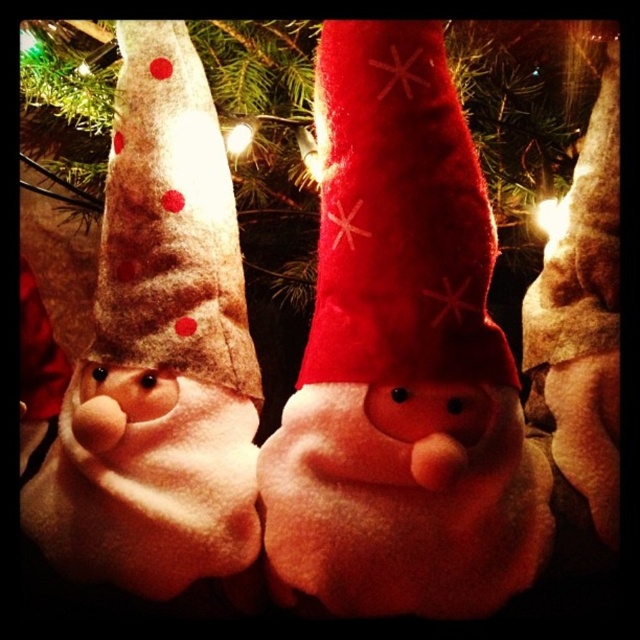
Between beige felt gnome at left and red felt santa hat at center, which one is positioned higher?

red felt santa hat at center is higher up.

Can you confirm if beige felt gnome at left is shorter than red felt santa hat at center?

In fact, beige felt gnome at left may be taller than red felt santa hat at center.

Does point (140, 138) lie behind point (349, 368)?

Yes.

The width and height of the screenshot is (640, 640). Identify the location of beige felt gnome at left. (157, 352).

Between red felt santa at center and beige felt gnome at left, which one has more height?

beige felt gnome at left

Who is more forward, (458, 592) or (243, 278)?

Point (458, 592) is more forward.

Which is behind, point (342, 195) or point (145, 177)?

The point (145, 177) is more distant.

At what (x,y) coordinates should I click in order to perform the action: click on red felt santa at center. Please return your answer as a coordinate pair (x, y). The image size is (640, 640). Looking at the image, I should click on (401, 358).

In the scene shown: Does red felt santa at center lie behind beige felt hat with red polka dots at left?

That is False.

Can you confirm if red felt santa at center is thinner than beige felt hat with red polka dots at left?

Incorrect, red felt santa at center's width is not less than beige felt hat with red polka dots at left's.

Between point (461, 173) and point (237, 316), which one is positioned behind?

The point (237, 316) is behind.

In order to click on red felt santa at center in this screenshot , I will do `click(401, 358)`.